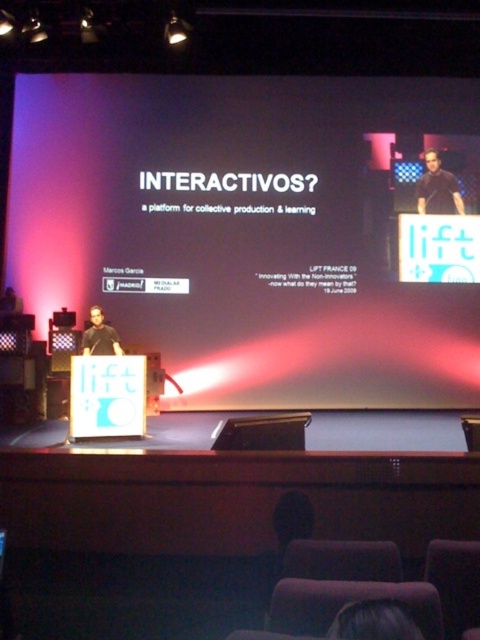
You are an attendee at the presentation. You notice the white matte projection screen at upper center and the black shirt at upper right. Which object is positioned lower in the image?

The white matte projection screen at upper center is located below the black shirt at upper right, so it is positioned lower in the image.

You are an event planner preparing for a presentation. You need to ensure that the white matte projection screen at upper center is visible to all attendees. Considering the height of the dark brown hair at upper center, which is part of the presenter, can the screen be seen over the presenter?

The white matte projection screen at upper center has a greater height compared to dark brown hair at upper center, so yes, the screen can be seen over the presenter because it is taller than the presenter.